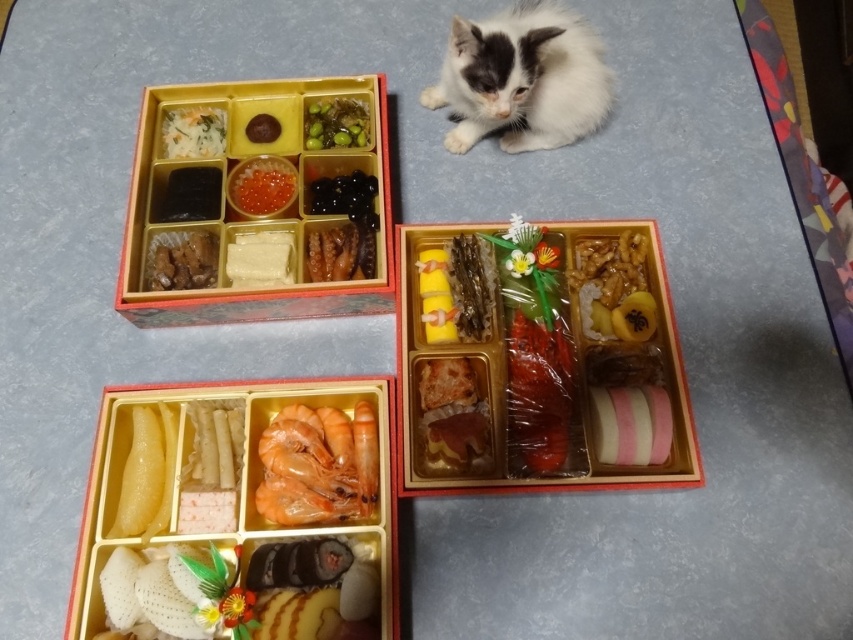
Question: Based on their relative distances, which object is nearer to the shiny orange caviar at center?

Choices:
 (A) pink striped sushi at lower right
 (B) shiny pinkish-orange shrimp at lower left
 (C) green glossy seaweed at upper center

Answer: (C)

Question: Does shiny orange caviar at center appear over green glossy seaweed at upper center?

Choices:
 (A) yes
 (B) no

Answer: (B)

Question: Can you confirm if pink striped sushi at lower right is positioned above shiny orange caviar at center?

Choices:
 (A) no
 (B) yes

Answer: (A)

Question: Estimate the real-world distances between objects in this image. Which object is farther from the shiny pinkish-orange shrimp at lower left?

Choices:
 (A) brown glossy dried seaweed at upper left
 (B) white fluffy cat at upper right
 (C) white rice at upper left

Answer: (B)

Question: Does pink striped sushi at lower right appear under brown glossy dried seaweed at upper left?

Choices:
 (A) yes
 (B) no

Answer: (A)

Question: Which of the following is the farthest from the observer?

Choices:
 (A) (316, 147)
 (B) (183, 124)
 (C) (166, 240)
 (D) (340, 424)

Answer: (B)